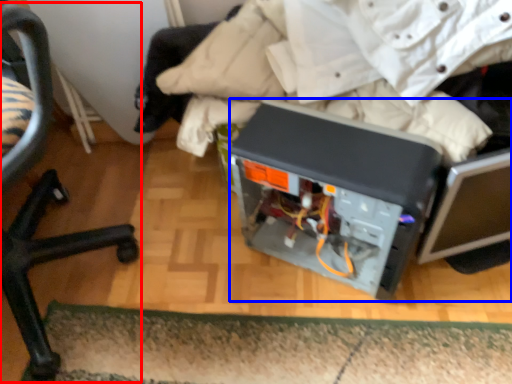
Question: Among these objects, which one is nearest to the camera, chair (highlighted by a red box) or wide (highlighted by a blue box)?

Choices:
 (A) chair
 (B) wide

Answer: (A)